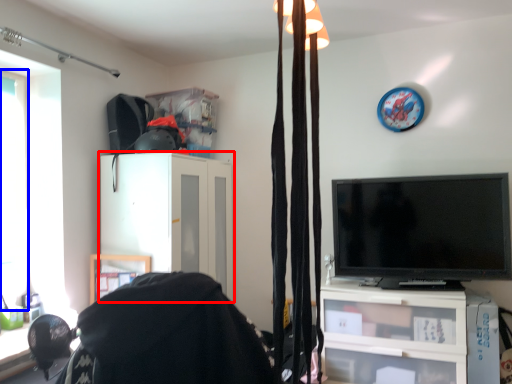
Question: Among these objects, which one is farthest to the camera, cabinetry (highlighted by a red box) or window (highlighted by a blue box)?

Choices:
 (A) cabinetry
 (B) window

Answer: (A)